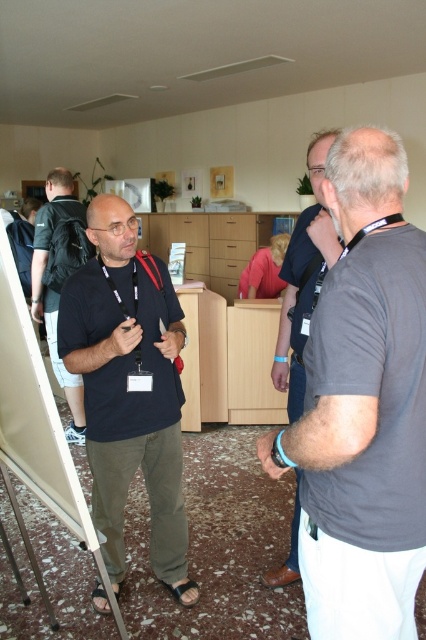
Question: Is black matte shirt at center bigger than white matte easel at center?

Choices:
 (A) no
 (B) yes

Answer: (A)

Question: Which of the following is the farthest from the observer?

Choices:
 (A) (58, 202)
 (B) (357, 148)
 (C) (278, 364)
 (D) (57, 515)

Answer: (A)

Question: Among these objects, which one is farthest from the camera?

Choices:
 (A) gray fabric shirt at center
 (B) white matte easel at center

Answer: (A)

Question: From the image, what is the correct spatial relationship of gray cotton t-shirt at center in relation to matte black shirt at left?

Choices:
 (A) right
 (B) left

Answer: (A)

Question: Based on their relative distances, which object is farther from the gray fabric shirt at center?

Choices:
 (A) matte black shirt at left
 (B) gray cotton t-shirt at center
 (C) white matte easel at center

Answer: (A)

Question: Can you confirm if gray cotton t-shirt at center is positioned to the right of gray fabric shirt at center?

Choices:
 (A) no
 (B) yes

Answer: (B)